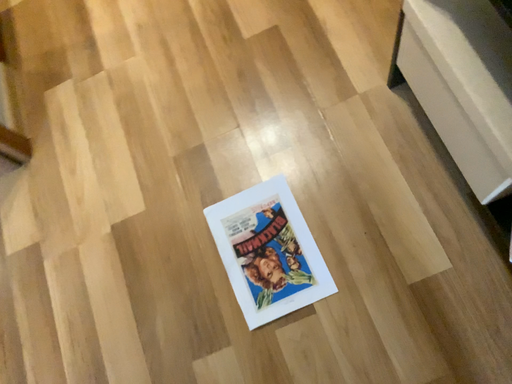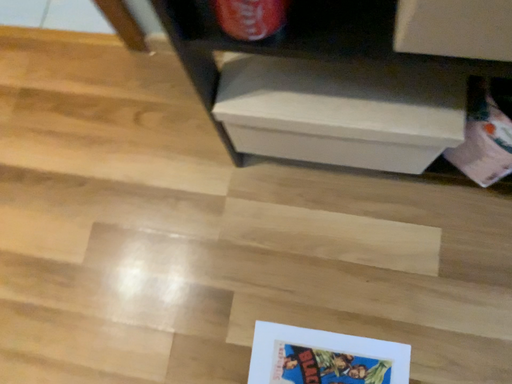
Question: How did the camera likely rotate when shooting the video?

Choices:
 (A) rotated right
 (B) rotated left

Answer: (A)